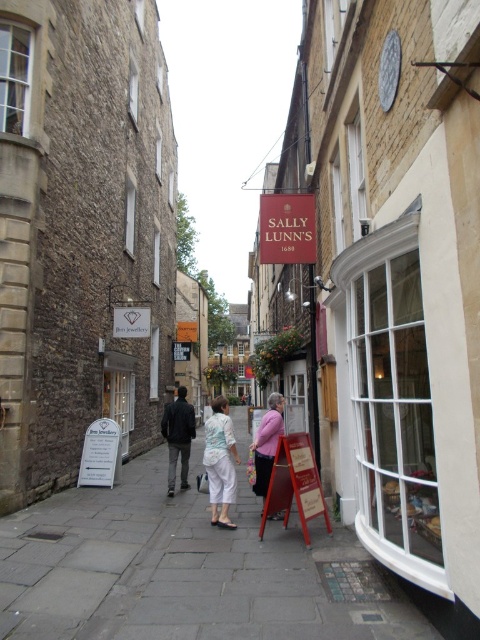
You are standing at the point closest to the camera in this historic street scene. There are two points marked on the image, one at coordinates point (224, 474) and the other at point (263, 492). Which of these points is closer to your current position?

The point at coordinates point (224, 474) is closer to your current position because it is closer to the camera than point (263, 492).

You are a delivery person holding a package addressed to the light blue fabric blouse at center. You are standing on the gray stone pavement at center. Which direction should you move to reach the blouse?

The gray stone pavement at center is below the light blue fabric blouse at center, so you should move upward from the gray stone pavement at center to reach the light blue fabric blouse at center.